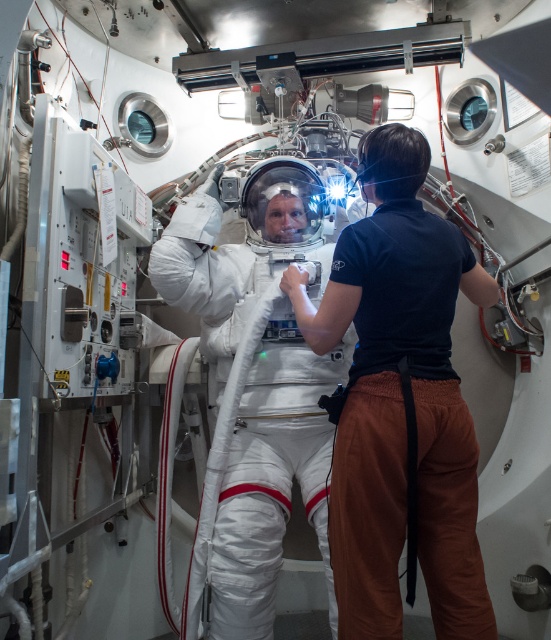
Question: Does white fabric spacesuit at center have a lesser width compared to white smooth spacesuit at center?

Choices:
 (A) yes
 (B) no

Answer: (A)

Question: Which of the following is the closest to the observer?

Choices:
 (A) 310,440
 (B) 338,237

Answer: (B)

Question: Does white fabric spacesuit at center have a greater width compared to white smooth spacesuit at center?

Choices:
 (A) yes
 (B) no

Answer: (B)

Question: Where is white fabric spacesuit at center located in relation to white smooth spacesuit at center in the image?

Choices:
 (A) left
 (B) right

Answer: (B)